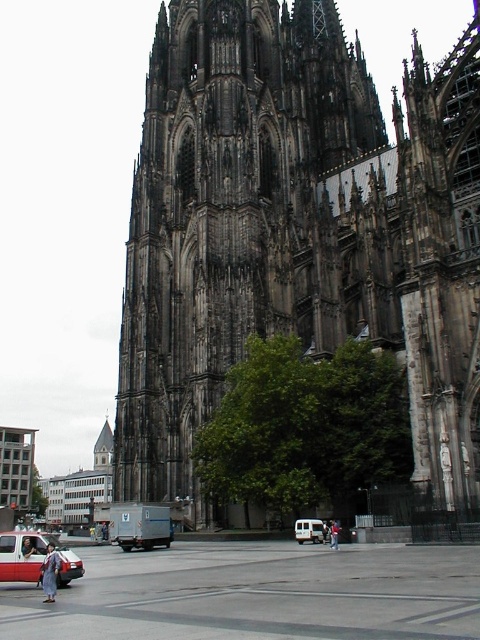
Question: Does matte red car at lower left lie in front of white matte van at center?

Choices:
 (A) no
 (B) yes

Answer: (B)

Question: Is dark stone church at center to the left of white matte van at center from the viewer's perspective?

Choices:
 (A) yes
 (B) no

Answer: (B)

Question: Does dark stone church at center appear on the right side of matte red car at lower left?

Choices:
 (A) no
 (B) yes

Answer: (B)

Question: Estimate the real-world distances between objects in this image. Which object is farther from the matte red car at lower left?

Choices:
 (A) dark stone church at center
 (B) white matte van at center

Answer: (A)

Question: Which point is farther to the camera?

Choices:
 (A) (240, 355)
 (B) (46, 536)
 (C) (323, 525)

Answer: (A)

Question: Which is nearer to the matte red car at lower left?

Choices:
 (A) dark stone church at center
 (B) white matte van at center

Answer: (B)